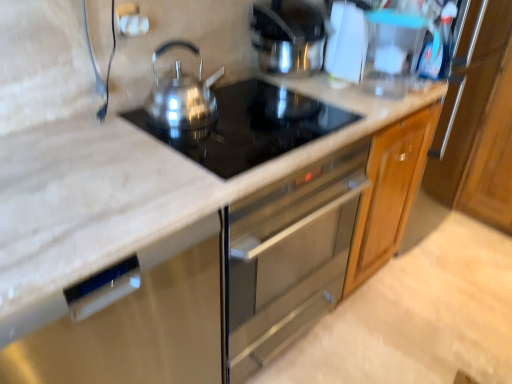
At what (x,y) coordinates should I click in order to perform the action: click on free spot to the right of black marble countertop at center. Please return your answer as a coordinate pair (x, y). The height and width of the screenshot is (384, 512). Looking at the image, I should click on (385, 335).